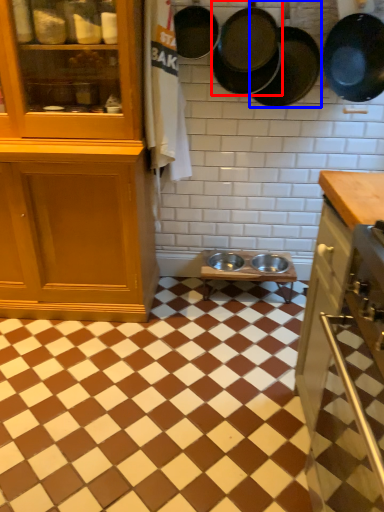
Question: Which of the following is the closest to the observer, frying pan (highlighted by a red box) or frying pan (highlighted by a blue box)?

Choices:
 (A) frying pan
 (B) frying pan

Answer: (B)